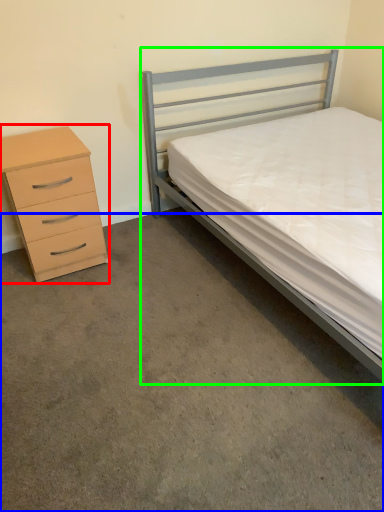
Question: Which is farther away from chest of drawers (highlighted by a red box)? concrete (highlighted by a blue box) or bed (highlighted by a green box)?

Choices:
 (A) concrete
 (B) bed

Answer: (B)